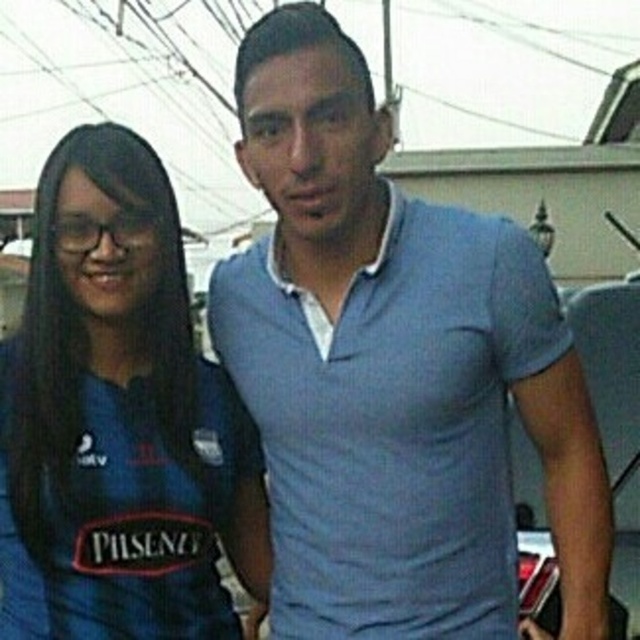
Question: Is matte blue polo shirt at center below blue fabric shirt at left?

Choices:
 (A) no
 (B) yes

Answer: (A)

Question: Does matte blue polo shirt at center come behind blue fabric shirt at left?

Choices:
 (A) no
 (B) yes

Answer: (A)

Question: Where is matte blue polo shirt at center located in relation to blue fabric shirt at left in the image?

Choices:
 (A) below
 (B) above

Answer: (B)

Question: Which point appears closest to the camera in this image?

Choices:
 (A) (342, 404)
 (B) (93, 614)

Answer: (B)

Question: Which of the following is the closest to the observer?

Choices:
 (A) blue fabric shirt at left
 (B) matte blue polo shirt at center

Answer: (B)